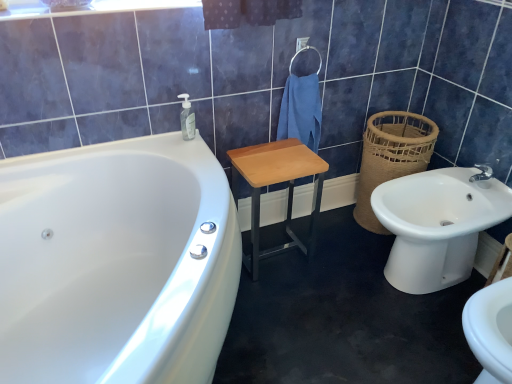
Image resolution: width=512 pixels, height=384 pixels. In order to click on vacant space in between white ceramic sink at right and brown woven basket at right in this screenshot , I will do `click(356, 238)`.